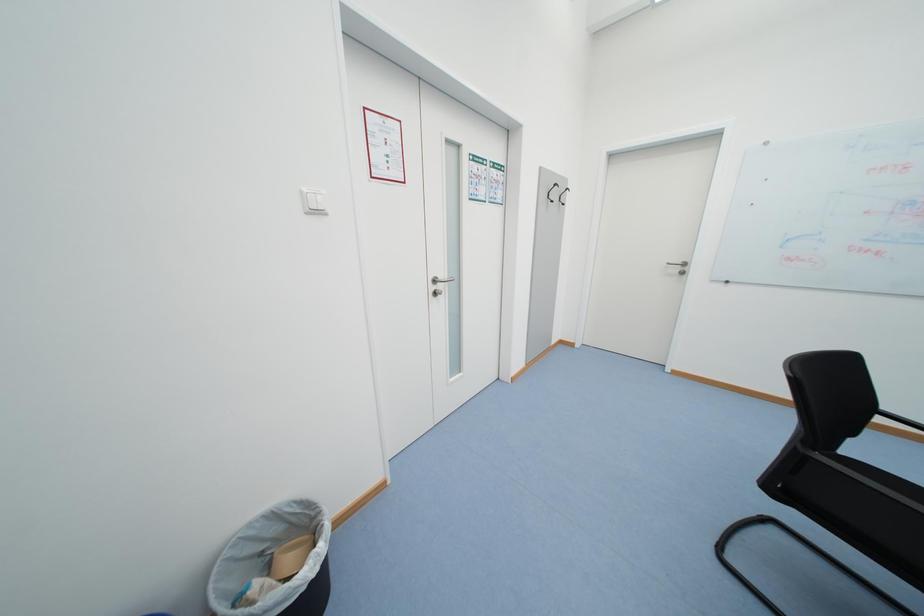
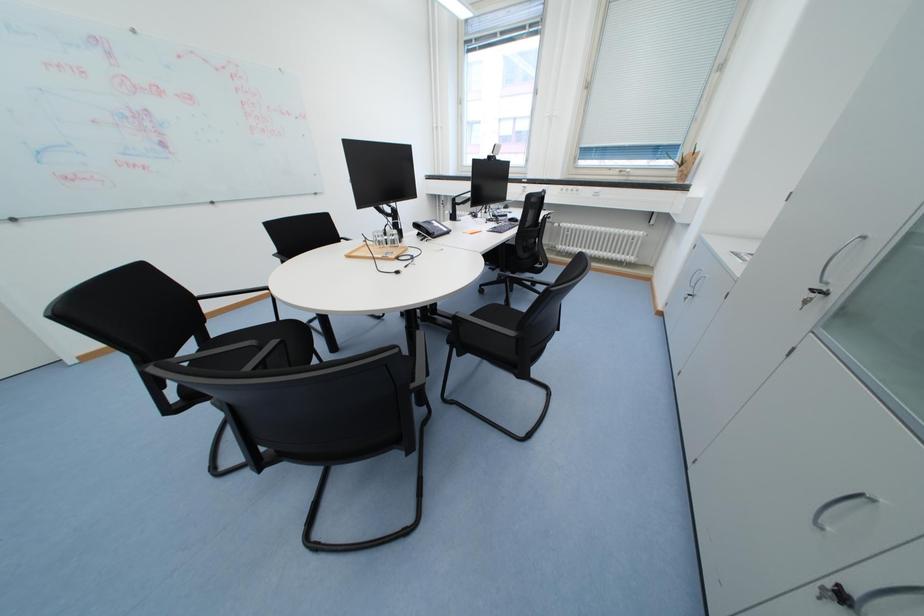
First-person continuous shooting, in which direction is the camera rotating?

The rotation direction of the camera is right-down.